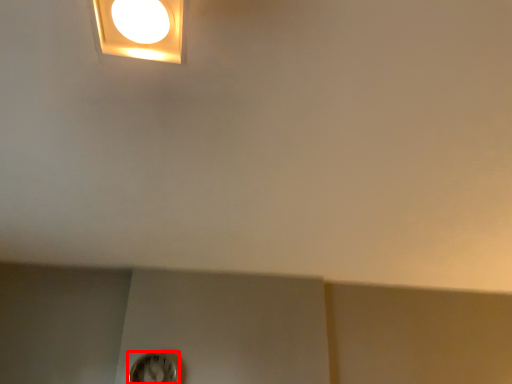
Question: From the image's perspective, considering the relative positions of clock (annotated by the red box) and lamp in the image provided, where is clock (annotated by the red box) located with respect to the staircase?

Choices:
 (A) below
 (B) above

Answer: (A)